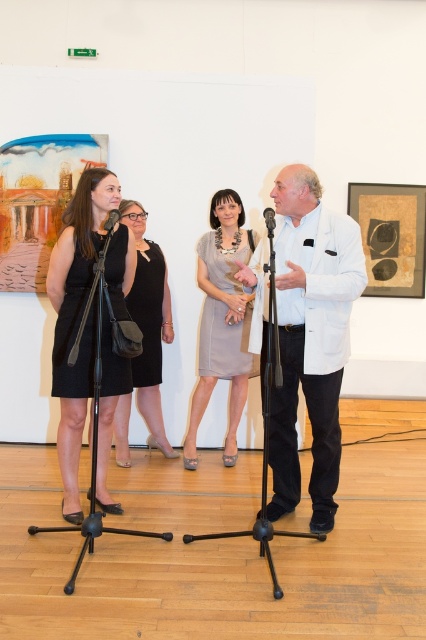
Question: Among these points, which one is nearest to the camera?

Choices:
 (A) (236, 374)
 (B) (265, 218)
 (C) (141, 404)
 (D) (111, 221)

Answer: (B)

Question: Which point is farther to the camera?

Choices:
 (A) black metal tripod at left
 (B) white smooth coat at center
 (C) black matte dress at center
 (D) light gray fabric dress at center

Answer: (C)

Question: Does light gray fabric dress at center lie in front of black matte microphone at center?

Choices:
 (A) yes
 (B) no

Answer: (B)

Question: Among these points, which one is farthest from the camera?

Choices:
 (A) (226, 461)
 (B) (271, 246)
 (C) (66, 220)

Answer: (A)

Question: Can you confirm if light gray fabric dress at center is wider than black matte microphone at center?

Choices:
 (A) yes
 (B) no

Answer: (A)

Question: Is white smooth coat at center to the left of light gray fabric dress at center from the viewer's perspective?

Choices:
 (A) yes
 (B) no

Answer: (B)